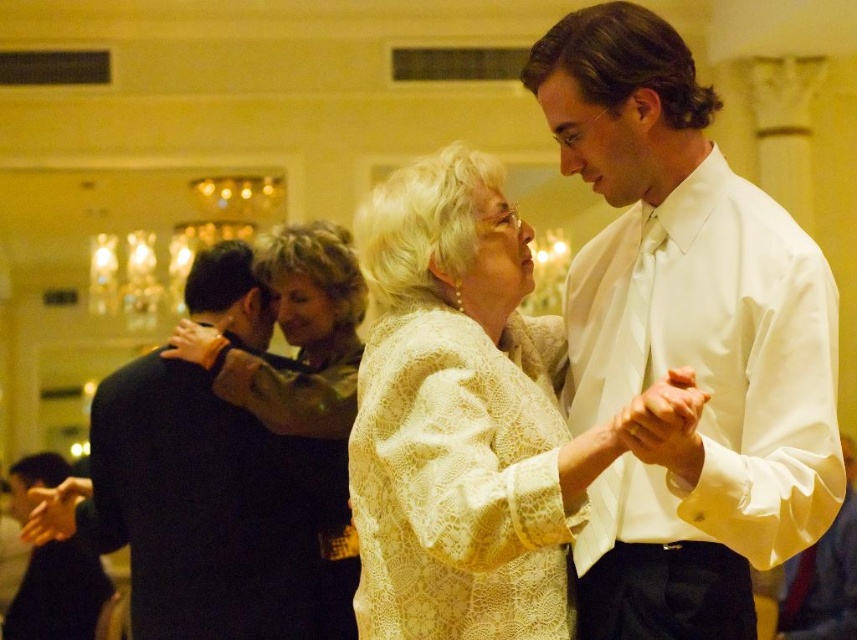
You are a photographer at a wedding reception. You need to take a photo of the white satin shirt at center and the lace fabric dress at center so that both are clearly visible in the frame. Given that your camera has a maximum focus range of 4 meters, will you be able to capture both subjects in focus?

The white satin shirt at center and lace fabric dress at center are 4.17 meters apart. Since the camera can only focus up to 4 meters, the distance between them exceeds the maximum focus range. Therefore, you won cannot capture both subjects in focus.

You are a photographer at a wedding reception and want to capture a photo of the white satin shirt at center and the lacy beige dress at center. From the perspective of the photographer, which one is positioned to the right?

The white satin shirt at center is positioned to the right of the lacy beige dress at center.

You are a photographer at the event and want to capture a photo of both the white satin shirt at center and the lacy beige dress at center in the same frame. Which one of these two items should you focus on first to ensure they are both in focus?

The white satin shirt at center is shorter than the lacy beige dress at center, so focusing on the lacy beige dress at center first will ensure both are in focus since it is taller and occupies more space in the frame.